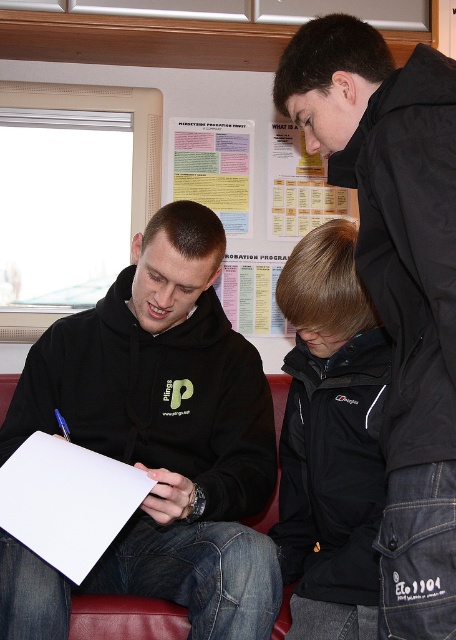
Question: Which object appears farthest from the camera in this image?

Choices:
 (A) yellow paper poster at upper center
 (B) white paper at lower left

Answer: (A)

Question: Based on their relative distances, which object is nearer to the black matte hoodie at center?

Choices:
 (A) yellow paper at upper center
 (B) black softshell jacket at lower right
 (C) yellow paper poster at upper center
 (D) black matte jacket at upper right

Answer: (B)

Question: Can you confirm if black matte sweatshirt at upper right is bigger than white paper at lower left?

Choices:
 (A) yes
 (B) no

Answer: (A)

Question: Which object appears closest to the camera in this image?

Choices:
 (A) black softshell jacket at lower right
 (B) black matte jacket at upper right
 (C) metallic blue pen at lower left
 (D) black matte hoodie at center

Answer: (B)

Question: Does yellow paper poster at upper center appear over metallic blue pen at lower left?

Choices:
 (A) yes
 (B) no

Answer: (A)

Question: Can you confirm if white paper at lower left is wider than yellow paper at upper center?

Choices:
 (A) yes
 (B) no

Answer: (A)